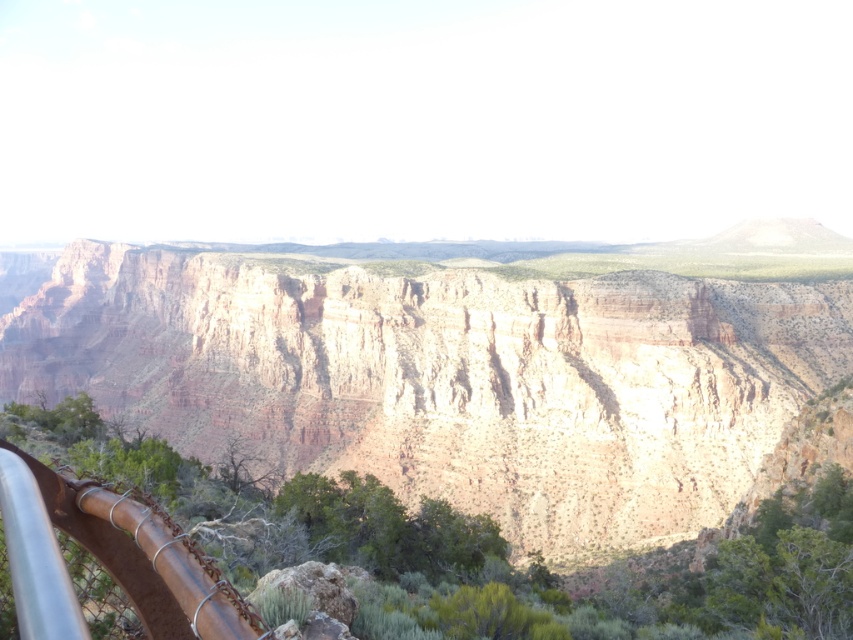
You are a geologist examining the image of the canyon. You need to determine which object occupies more space in the scene between the rustic rock formation at center and the rusty metal rail at lower left. Which one is bigger?

The rustic rock formation at center has a larger size compared to the rusty metal rail at lower left, so the rustic rock formation at center is bigger.